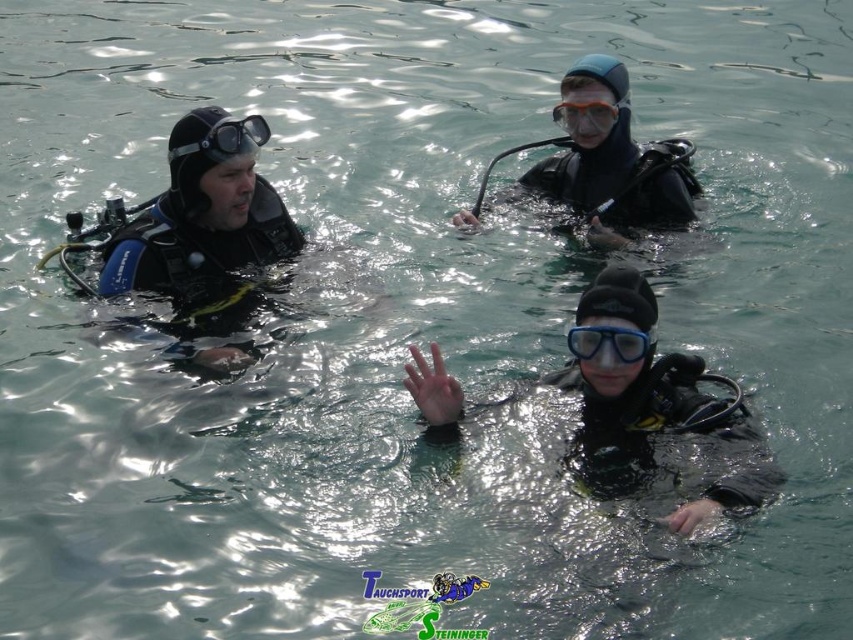
Can you confirm if black matte wetsuit at center is positioned to the right of transparent orange goggles at center?

In fact, black matte wetsuit at center is to the left of transparent orange goggles at center.

Where is `black matte wetsuit at center`? The height and width of the screenshot is (640, 853). black matte wetsuit at center is located at coordinates (659, 413).

Who is more distant from viewer, (641, 294) or (560, 116)?

The point (560, 116) is behind.

Identify the location of black matte wetsuit at center. (659, 413).

Between black matte wetsuit at upper center and transparent orange goggles at center, which one is positioned lower?

black matte wetsuit at upper center is below.

Who is positioned more to the left, black matte wetsuit at upper center or transparent orange goggles at center?

Positioned to the left is transparent orange goggles at center.

Locate an element on the screen. black matte wetsuit at upper center is located at coordinates (611, 161).

Between black matte wetsuit at left and transparent rubber goggles at center, which one has more height?

black matte wetsuit at left

Does black matte wetsuit at left have a smaller size compared to transparent rubber goggles at center?

Incorrect, black matte wetsuit at left is not smaller in size than transparent rubber goggles at center.

Between point (273, 202) and point (630, 360), which one is positioned behind?

The point (273, 202) is more distant.

Locate an element on the screen. The image size is (853, 640). black matte wetsuit at left is located at coordinates (202, 218).